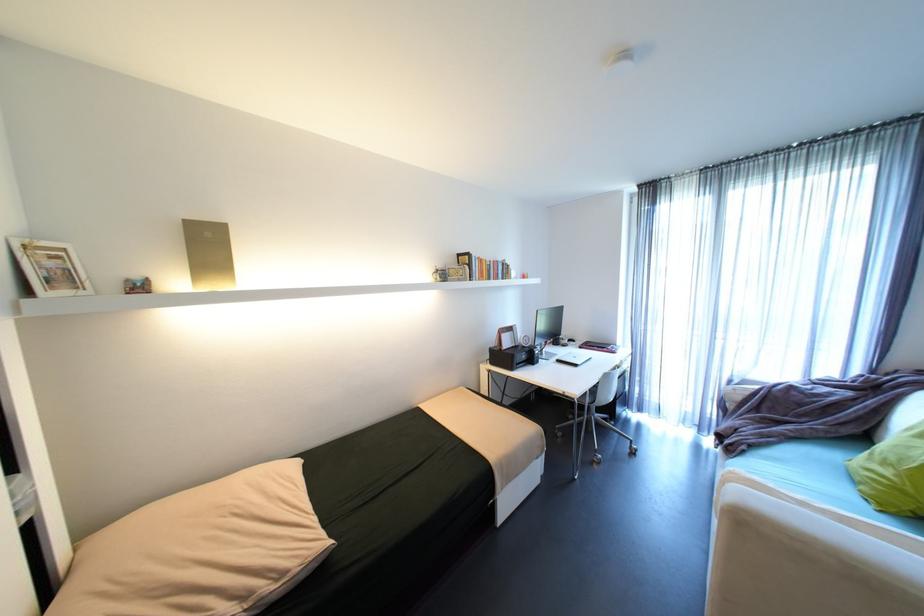
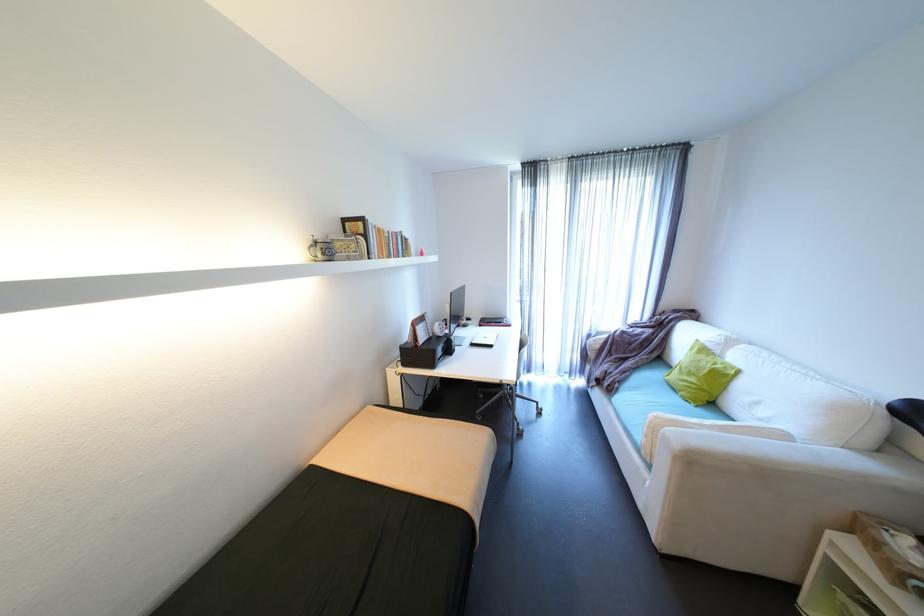
Question: I am providing you with two images of the same scene from different viewpoints. After the viewpoint changes to image2, which objects are now occluded?

Choices:
 (A) sofa sitting surface
 (B) chair sitting surface
 (C) green cushion
 (D) black liquor bottle

Answer: (B)